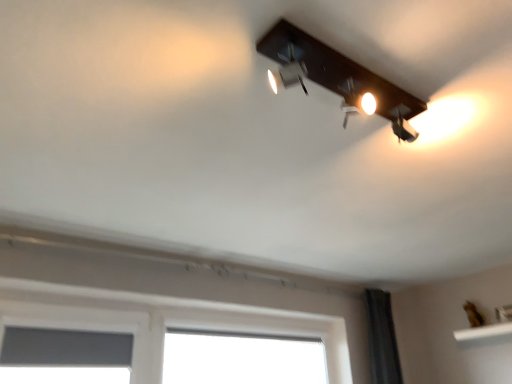
Question: Is matte black light fixture at upper center touching matte gray window screen at lower left?

Choices:
 (A) yes
 (B) no

Answer: (B)

Question: Is matte black light fixture at upper center not inside matte gray window screen at lower left?

Choices:
 (A) no
 (B) yes

Answer: (B)

Question: From the image's perspective, is matte black light fixture at upper center on matte gray window screen at lower left?

Choices:
 (A) yes
 (B) no

Answer: (A)

Question: Considering the relative sizes of matte black light fixture at upper center and matte gray window screen at lower left in the image provided, is matte black light fixture at upper center bigger than matte gray window screen at lower left?

Choices:
 (A) yes
 (B) no

Answer: (B)

Question: Is matte black light fixture at upper center aimed at matte gray window screen at lower left?

Choices:
 (A) no
 (B) yes

Answer: (A)

Question: Is matte gray window screen at lower left surrounded by matte black light fixture at upper center?

Choices:
 (A) yes
 (B) no

Answer: (B)

Question: Can you confirm if matte gray window screen at lower left is positioned to the right of matte black light fixture at upper center?

Choices:
 (A) no
 (B) yes

Answer: (A)

Question: Considering the relative positions of matte gray window screen at lower left and matte black light fixture at upper center in the image provided, is matte gray window screen at lower left to the left of matte black light fixture at upper center from the viewer's perspective?

Choices:
 (A) yes
 (B) no

Answer: (A)

Question: Is matte gray window screen at lower left further to camera compared to matte black light fixture at upper center?

Choices:
 (A) yes
 (B) no

Answer: (A)

Question: Is matte gray window screen at lower left far away from matte black light fixture at upper center?

Choices:
 (A) yes
 (B) no

Answer: (A)

Question: Is matte gray window screen at lower left taller than matte black light fixture at upper center?

Choices:
 (A) yes
 (B) no

Answer: (A)

Question: Is matte black light fixture at upper center surrounded by matte gray window screen at lower left?

Choices:
 (A) no
 (B) yes

Answer: (A)

Question: Based on their sizes in the image, would you say matte gray window screen at lower left is bigger or smaller than matte black light fixture at upper center?

Choices:
 (A) big
 (B) small

Answer: (A)